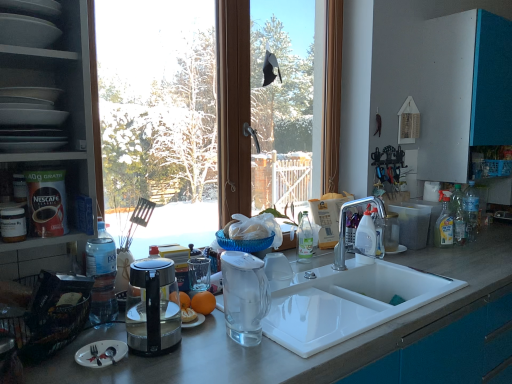
You are a GUI agent. You are given a task and a screenshot of the screen. Output one action in this format:
    pyautogui.click(x=<x>, y=<y>)
    Task: Click on the vacant area that is in front of orange matte at center
    
    Given the screenshot: What is the action you would take?
    coord(208,339)